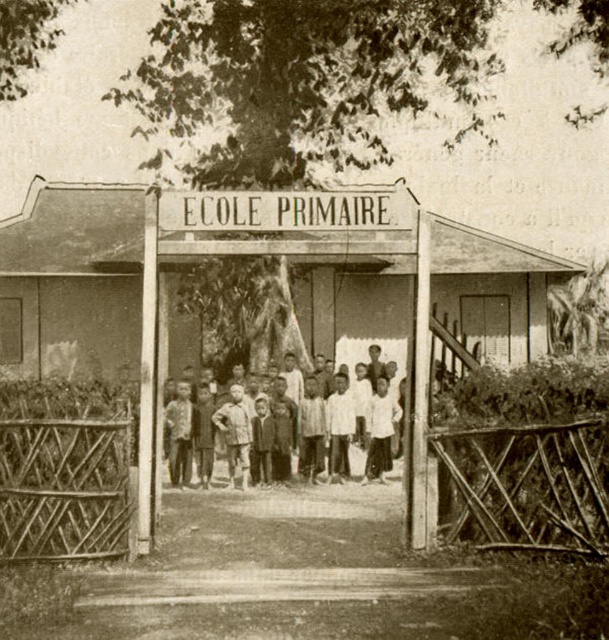
Which is behind, point (18, 374) or point (371, 401)?

The point (18, 374) is more distant.

Between point (412, 525) and point (219, 419), which one is positioned in front?

Point (412, 525)

Where is `wooden sign at center`? This screenshot has height=640, width=609. wooden sign at center is located at coordinates (264, 296).